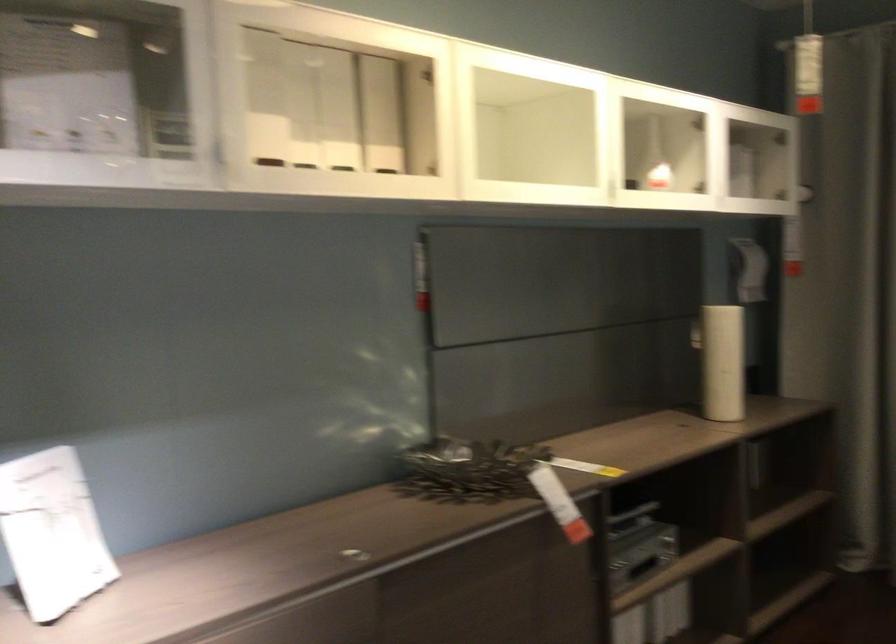
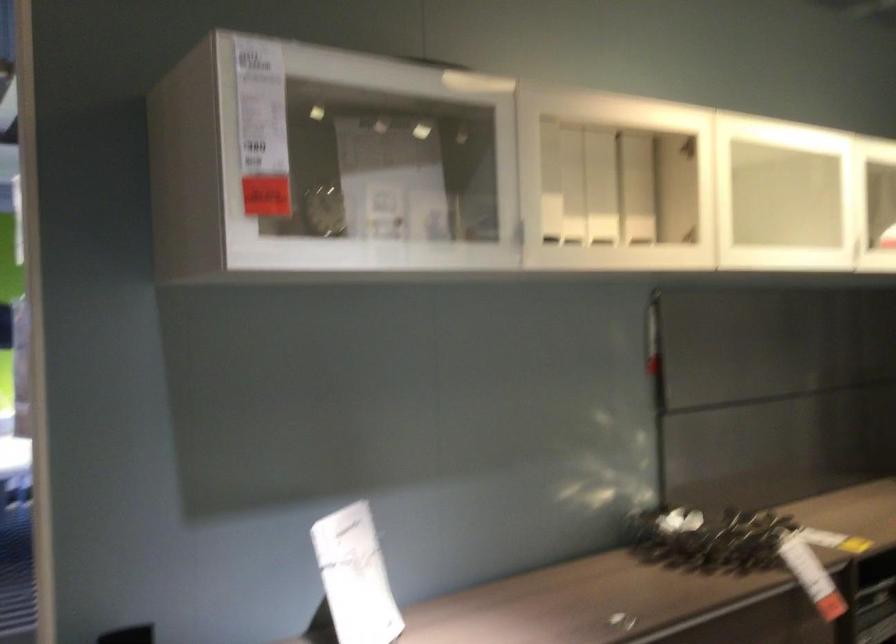
In a continuous first-person perspective shot, in which direction is the camera moving?

The movement direction of the cameraman is left, backward.